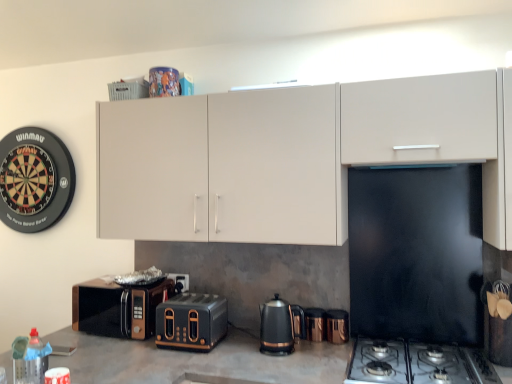
Question: Is black metallic toaster at center wider than copper metallic kettle at center, marked as the 2th appliance in a left-to-right arrangement?

Choices:
 (A) yes
 (B) no

Answer: (A)

Question: From the image's perspective, is black metallic toaster at center over copper metallic kettle at center, marked as the 2th appliance in a left-to-right arrangement?

Choices:
 (A) yes
 (B) no

Answer: (A)

Question: Is black metallic toaster at center at the left side of copper metallic kettle at center, marked as the 2th appliance in a left-to-right arrangement?

Choices:
 (A) yes
 (B) no

Answer: (A)

Question: Considering the relative sizes of black metallic toaster at center and copper metallic kettle at center, acting as the first appliance starting from the right, in the image provided, is black metallic toaster at center shorter than copper metallic kettle at center, acting as the first appliance starting from the right,?

Choices:
 (A) no
 (B) yes

Answer: (A)

Question: Is black metallic toaster at center located outside copper metallic kettle at center, acting as the first appliance starting from the right?

Choices:
 (A) no
 (B) yes

Answer: (B)

Question: From a real-world perspective, does black metallic toaster at center sit lower than copper metallic kettle at center, marked as the 2th appliance in a left-to-right arrangement?

Choices:
 (A) no
 (B) yes

Answer: (A)

Question: From the image's perspective, would you say bronze metallic microwave at lower left is shown under copper metallic kettle at center, marked as the 2th appliance in a left-to-right arrangement?

Choices:
 (A) no
 (B) yes

Answer: (A)

Question: Is the position of bronze metallic microwave at lower left less distant than that of copper metallic kettle at center, marked as the 2th appliance in a left-to-right arrangement?

Choices:
 (A) yes
 (B) no

Answer: (B)

Question: Considering the relative positions of bronze metallic microwave at lower left and copper metallic kettle at center, marked as the 2th appliance in a left-to-right arrangement, in the image provided, is bronze metallic microwave at lower left to the left of copper metallic kettle at center, marked as the 2th appliance in a left-to-right arrangement, from the viewer's perspective?

Choices:
 (A) no
 (B) yes

Answer: (B)

Question: Is bronze metallic microwave at lower left aimed at copper metallic kettle at center, marked as the 2th appliance in a left-to-right arrangement?

Choices:
 (A) yes
 (B) no

Answer: (B)

Question: Is bronze metallic microwave at lower left in contact with copper metallic kettle at center, marked as the 2th appliance in a left-to-right arrangement?

Choices:
 (A) no
 (B) yes

Answer: (A)

Question: From a real-world perspective, is bronze metallic microwave at lower left on copper metallic kettle at center, marked as the 2th appliance in a left-to-right arrangement?

Choices:
 (A) no
 (B) yes

Answer: (B)

Question: Is matte white cabinet at upper center next to black metallic gas stove at lower right and touching it?

Choices:
 (A) yes
 (B) no

Answer: (B)